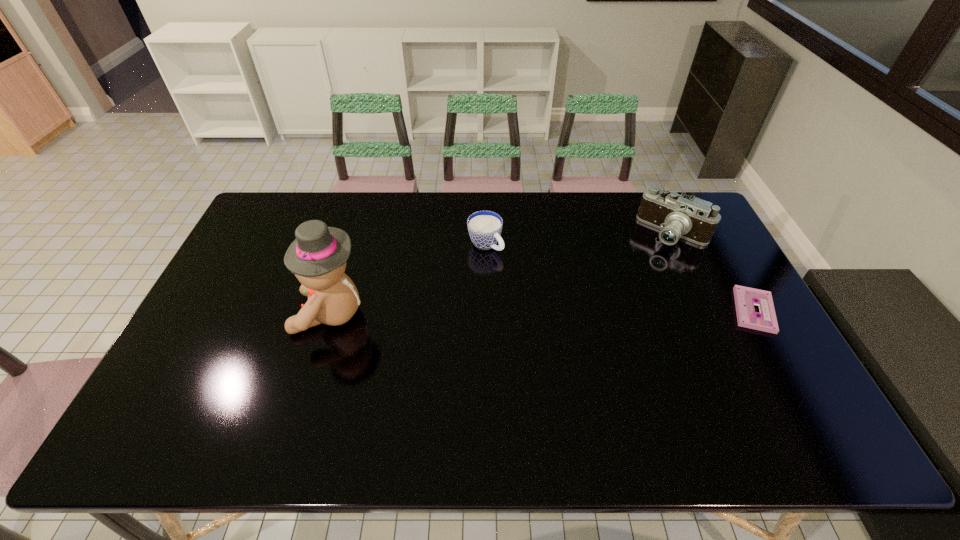
This screenshot has height=540, width=960. In order to click on the leftmost object in this screenshot , I will do click(x=318, y=255).

At what (x,y) coordinates should I click in order to perform the action: click on the tallest object. Please return your answer as a coordinate pair (x, y). Looking at the image, I should click on (318, 255).

Where is `the shortest object`? Image resolution: width=960 pixels, height=540 pixels. the shortest object is located at coordinates [745, 298].

This screenshot has width=960, height=540. What are the coordinates of `the third object from right to left` in the screenshot? It's located at (484, 227).

At what (x,y) coordinates should I click in order to perform the action: click on cup. Please return your answer as a coordinate pair (x, y). The width and height of the screenshot is (960, 540). Looking at the image, I should click on (484, 227).

Locate an element on the screen. camera is located at coordinates (677, 216).

You are a GUI agent. You are given a task and a screenshot of the screen. Output one action in this format:
    pyautogui.click(x=<x>, y=<y>)
    Task: Click on the free region located on the front-facing side of the rag_doll
    The image size is (960, 540).
    Given the screenshot: What is the action you would take?
    pyautogui.click(x=222, y=313)

Identify the location of free space located on the front-facing side of the rag_doll. (242, 313).

Locate an element on the screen. This screenshot has width=960, height=540. free region located 0.190m on the front-facing side of the rag_doll is located at coordinates (228, 313).

This screenshot has width=960, height=540. Find the location of `blank space located 0.060m on the front of the videotape`. blank space located 0.060m on the front of the videotape is located at coordinates (778, 353).